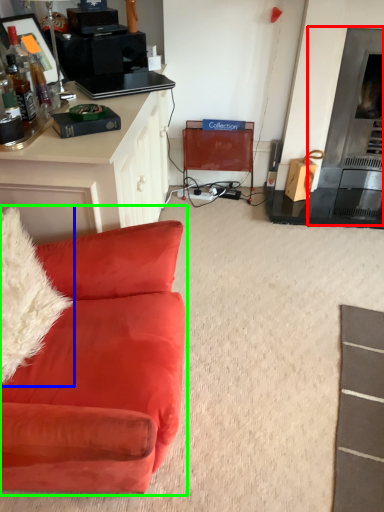
Question: Which object is positioned farthest from fireplace (highlighted by a red box)? Select from pillow (highlighted by a blue box) and studio couch (highlighted by a green box).

Choices:
 (A) pillow
 (B) studio couch

Answer: (A)